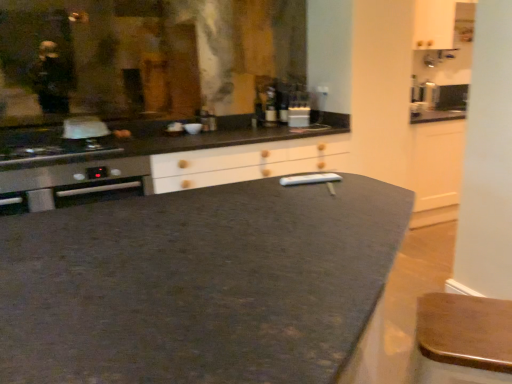
Identify the location of free space above dark granite countertop at center (from a real-world perspective). (209, 243).